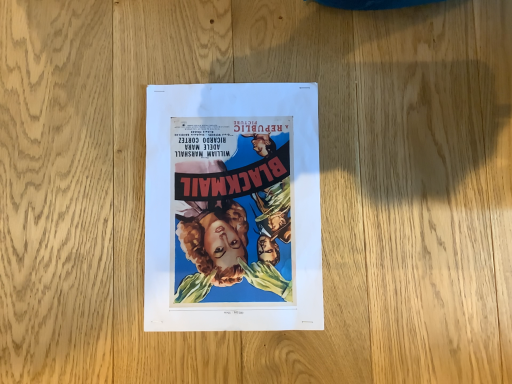
Identify the location of free point above matte paper poster at center (from a real-world perspective). (229, 202).